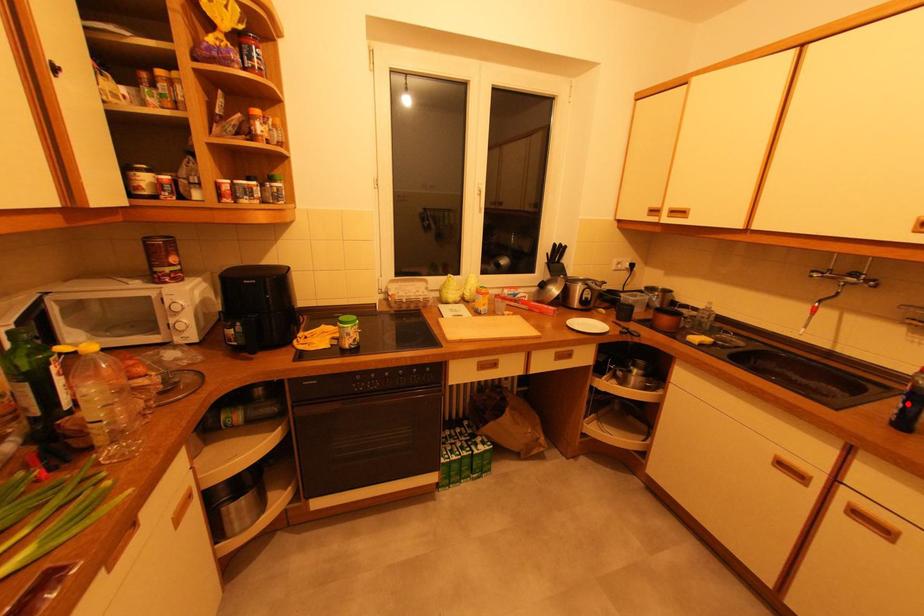
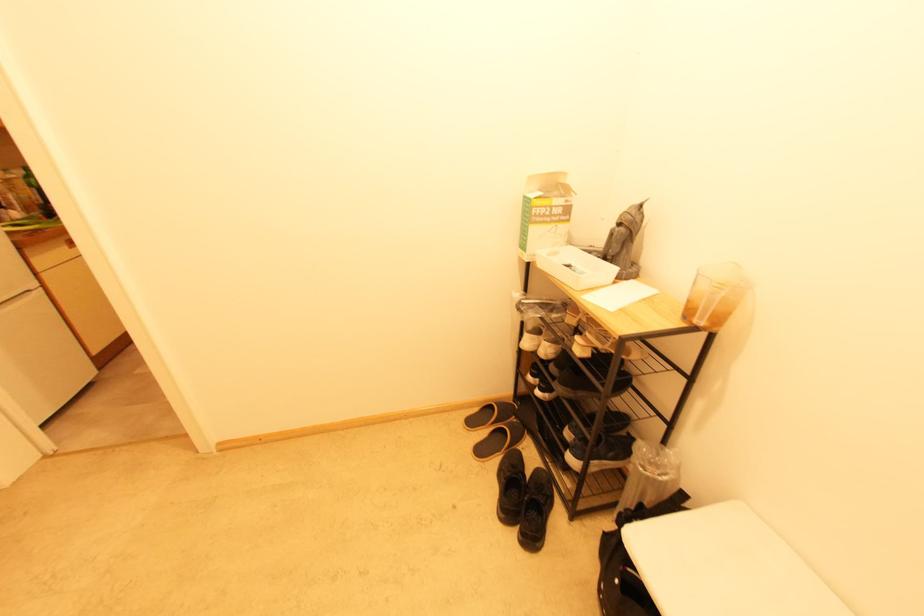
Question: I am providing you with two images of the same scene from different viewpoints. A red point is marked on the first image. Can you still see the location of the red point in image 2?

Choices:
 (A) Yes
 (B) No

Answer: (B)